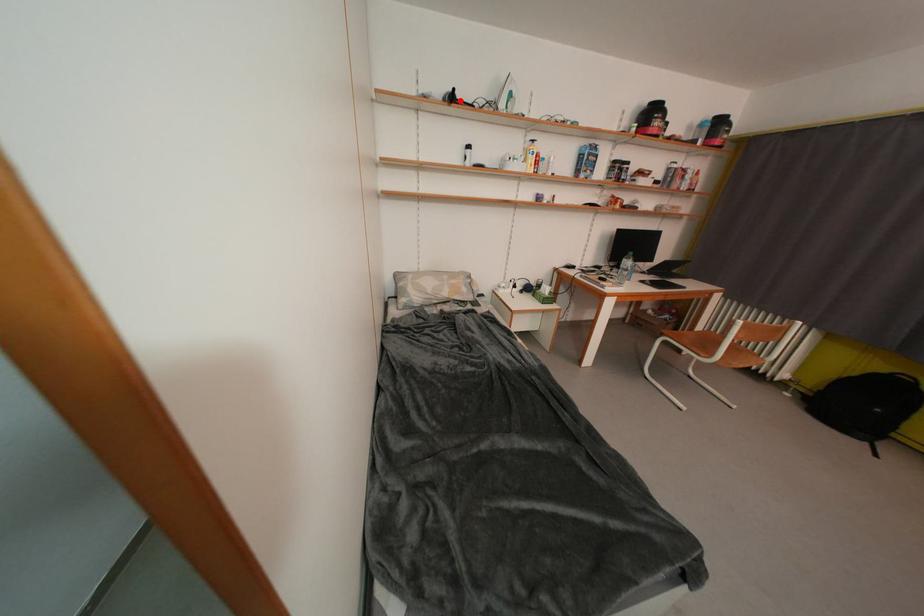
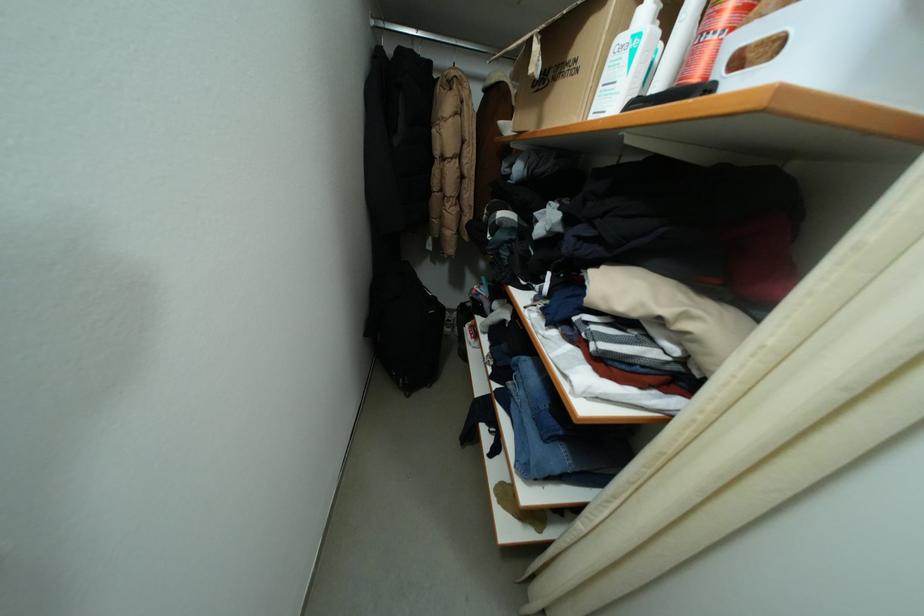
Question: I am providing you with two images of the same scene from different viewpoints. A red point is marked on the first image. Is the red point's position out of view in image 2?

Choices:
 (A) Yes
 (B) No

Answer: (A)